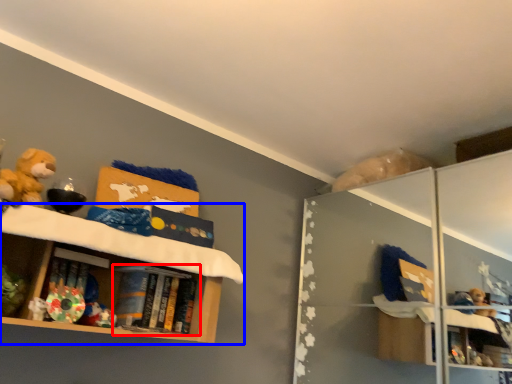
Question: Which object is closer to the camera taking this photo, book (highlighted by a red box) or shelf (highlighted by a blue box)?

Choices:
 (A) book
 (B) shelf

Answer: (B)